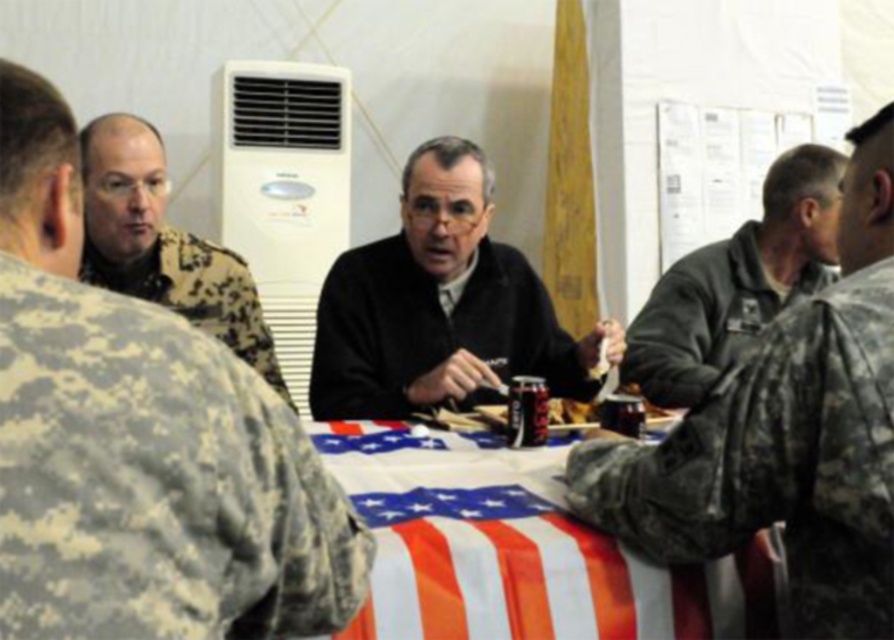
Is dark gray fleece jacket at right in front of black matte jacket at center?

Yes.

Is dark gray fleece jacket at right to the left of black matte jacket at center from the viewer's perspective?

No, dark gray fleece jacket at right is not to the left of black matte jacket at center.

Identify the location of dark gray fleece jacket at right. (785, 435).

The height and width of the screenshot is (640, 894). Find the location of `dark gray fleece jacket at right`. dark gray fleece jacket at right is located at coordinates (785, 435).

Is white plastic air conditioner at upper center shorter than camouflage uniform at left?

Incorrect, white plastic air conditioner at upper center's height does not fall short of camouflage uniform at left's.

Locate an element on the screen. This screenshot has height=640, width=894. white plastic air conditioner at upper center is located at coordinates (284, 189).

Is camouflage fabric uniform at left positioned before american flag tablecloth at center?

Yes.

Is point (277, 474) closer to camera compared to point (336, 476)?

Yes, it is.

The image size is (894, 640). What do you see at coordinates (155, 481) in the screenshot? I see `camouflage fabric uniform at left` at bounding box center [155, 481].

What are the coordinates of `camouflage fabric uniform at left` in the screenshot? It's located at (155, 481).